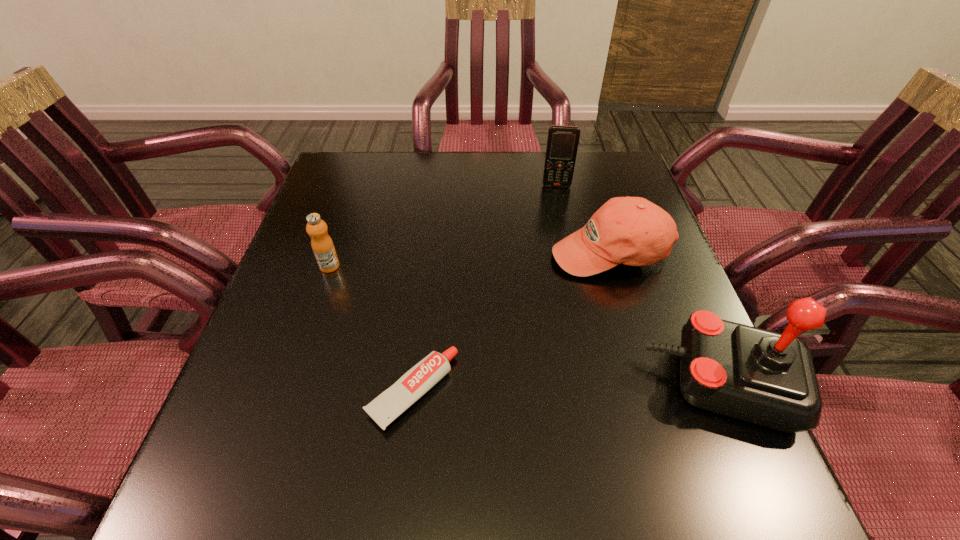
Where is `vacant spot on the desktop that is between the toothpaste and the joystick and is positioned on the front label of the leftmost object`? vacant spot on the desktop that is between the toothpaste and the joystick and is positioned on the front label of the leftmost object is located at coordinates (549, 388).

Where is `free space on the desktop that is between the toothpaste and the joystick and is positioned on the front-facing side of the baseball cap`? The image size is (960, 540). free space on the desktop that is between the toothpaste and the joystick and is positioned on the front-facing side of the baseball cap is located at coordinates (575, 388).

Where is `free space on the desktop that is between the second object from left to right and the joystick and is positioned on the screen of the cellular telephone`? This screenshot has width=960, height=540. free space on the desktop that is between the second object from left to right and the joystick and is positioned on the screen of the cellular telephone is located at coordinates (556, 388).